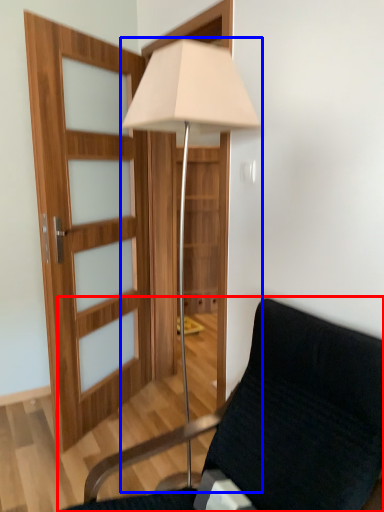
Question: Which object is further to the camera taking this photo, chair (highlighted by a red box) or lamp (highlighted by a blue box)?

Choices:
 (A) chair
 (B) lamp

Answer: (B)